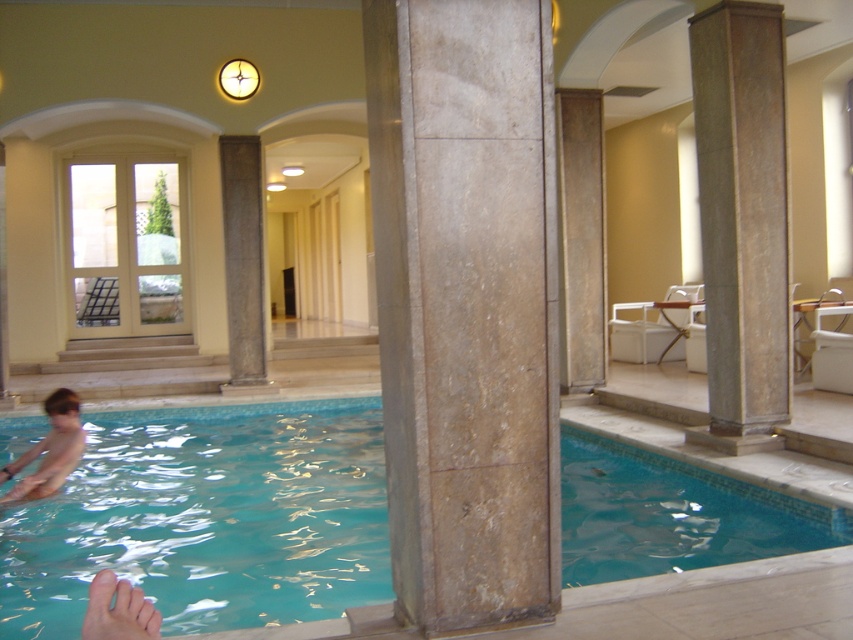
Looking at this image, which of these two, smooth stone column at center or light brown skin at lower left, stands taller?

smooth stone column at center is taller.

Is smooth stone column at center below light brown skin at lower left?

Incorrect, smooth stone column at center is not positioned below light brown skin at lower left.

This screenshot has height=640, width=853. I want to click on smooth stone column at center, so click(741, 221).

At what (x,y) coordinates should I click in order to perform the action: click on smooth stone column at center. Please return your answer as a coordinate pair (x, y). Image resolution: width=853 pixels, height=640 pixels. Looking at the image, I should click on (741, 221).

Between marble column at center and light brown skin at lower left, which one appears on the right side from the viewer's perspective?

From the viewer's perspective, marble column at center appears more on the right side.

Between marble column at center and light brown skin at lower left, which one is positioned higher?

marble column at center

Does point (503, 278) lie in front of point (10, 474)?

Yes.

You are a GUI agent. You are given a task and a screenshot of the screen. Output one action in this format:
    pyautogui.click(x=<x>, y=<y>)
    Task: Click on the marble column at center
    The height and width of the screenshot is (640, 853).
    Given the screenshot: What is the action you would take?
    pyautogui.click(x=465, y=307)

How much distance is there between marble column at center and smooth stone column at center?

marble column at center is 3.93 meters from smooth stone column at center.

Between marble column at center and smooth stone column at center, which one has more height?

With more height is smooth stone column at center.

The image size is (853, 640). I want to click on marble column at center, so click(465, 307).